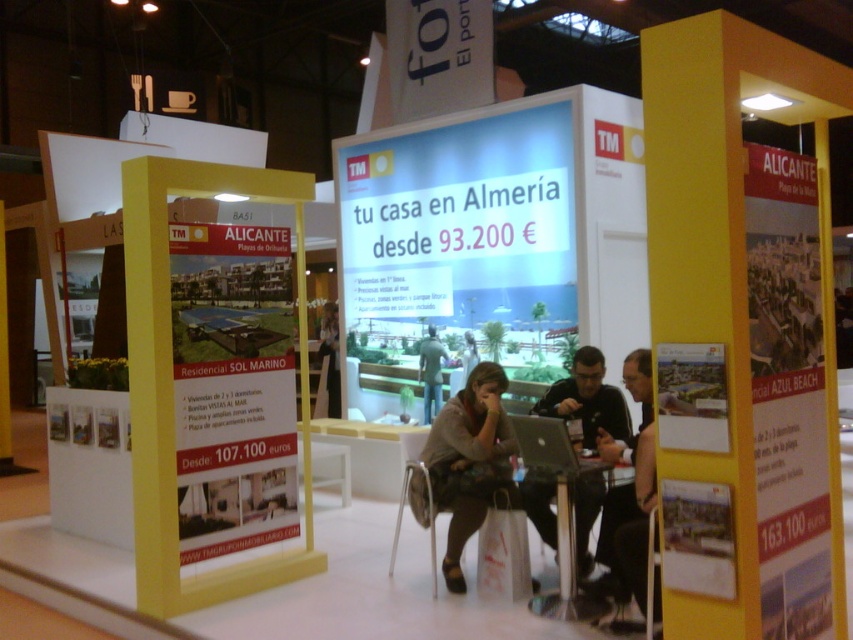
Question: Based on their relative distances, which object is farther from the silver metallic laptop at center?

Choices:
 (A) green fabric jacket at center
 (B) dark gray fabric jacket at center

Answer: (A)

Question: Can you confirm if brown fabric shirt at center is bigger than dark gray fabric jacket at center?

Choices:
 (A) no
 (B) yes

Answer: (B)

Question: Which point is farther from the camera taking this photo?

Choices:
 (A) (490, 401)
 (B) (540, 445)
 (C) (433, 404)

Answer: (C)

Question: Is matte black laptop at center to the left of green fabric jacket at center from the viewer's perspective?

Choices:
 (A) yes
 (B) no

Answer: (B)

Question: Estimate the real-world distances between objects in this image. Which object is farther from the matte black laptop at center?

Choices:
 (A) metallic silver table at center
 (B) green fabric jacket at center

Answer: (B)

Question: Is brown fabric shirt at center positioned before green fabric jacket at center?

Choices:
 (A) yes
 (B) no

Answer: (A)